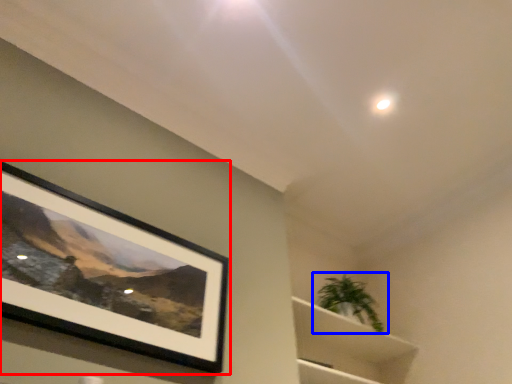
Question: Which of the following is the closest to the observer, picture frame (highlighted by a red box) or houseplant (highlighted by a blue box)?

Choices:
 (A) picture frame
 (B) houseplant

Answer: (A)